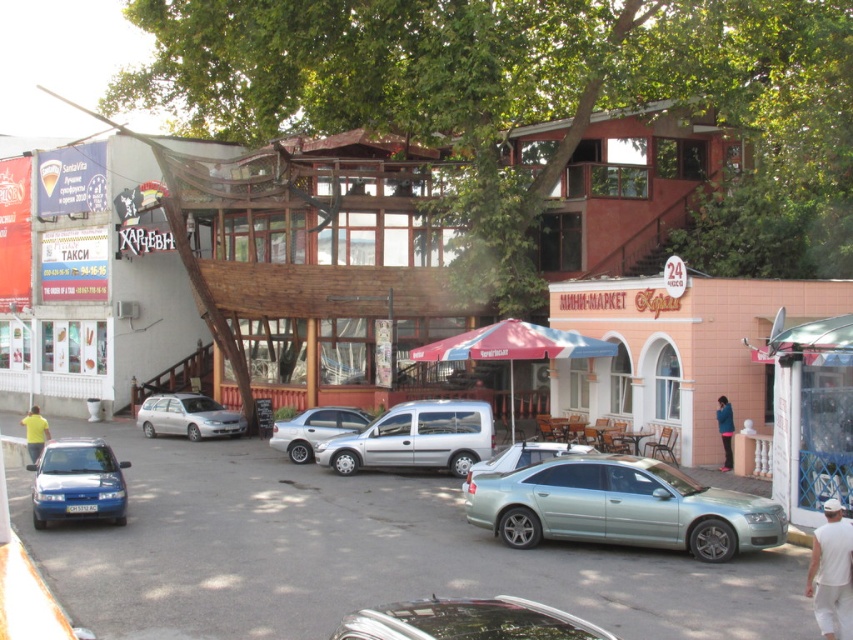
Which is more to the left, silver metallic sedan at center or yellow matte shirt at lower left?

Positioned to the left is yellow matte shirt at lower left.

Is the position of silver metallic sedan at center more distant than that of yellow matte shirt at lower left?

Yes, silver metallic sedan at center is behind yellow matte shirt at lower left.

The image size is (853, 640). What are the coordinates of `silver metallic sedan at center` in the screenshot? It's located at (314, 429).

Is silver metallic sedan at center taller than satin silver sedan at center?

Indeed, silver metallic sedan at center has a greater height compared to satin silver sedan at center.

How far apart are silver metallic sedan at center and satin silver sedan at center?

silver metallic sedan at center and satin silver sedan at center are 33.70 feet apart from each other.

Identify the location of silver metallic sedan at center. This screenshot has width=853, height=640. (314, 429).

Between shiny silver car at lower center and satin silver sedan at center, which one has more height?

With more height is satin silver sedan at center.

Does shiny silver car at lower center lie in front of satin silver sedan at center?

Yes, shiny silver car at lower center is closer to the viewer.

Is point (340, 624) less distant than point (491, 460)?

Yes, point (340, 624) is closer to viewer.

You are a GUI agent. You are given a task and a screenshot of the screen. Output one action in this format:
    pyautogui.click(x=<x>, y=<y>)
    Task: Click on the shiny silver car at lower center
    
    Given the screenshot: What is the action you would take?
    pyautogui.click(x=466, y=620)